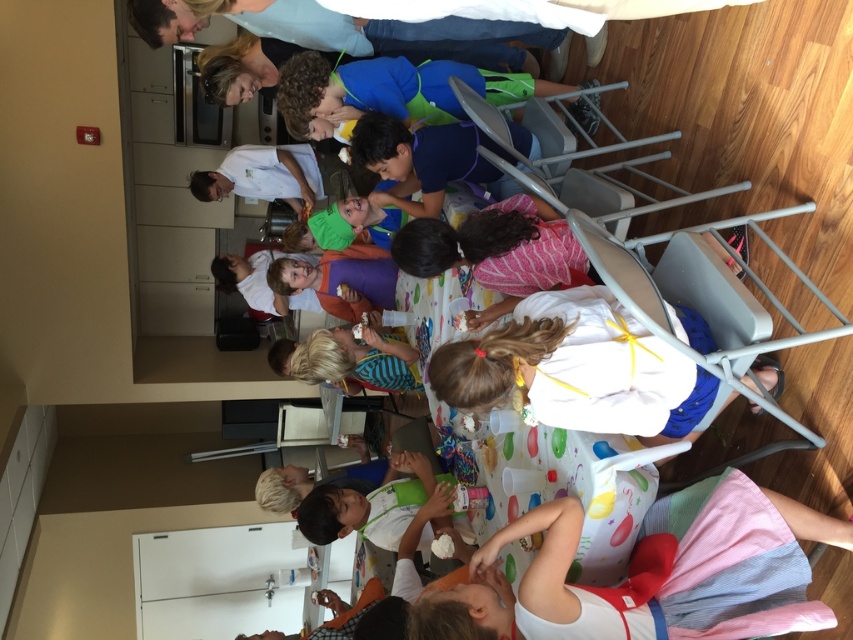
You are a photographer at the event and need to decide which shirt to focus on for a closeup. Since the white fabric shirt at center is wider than the striped fabric shirt at center, which shirt should you choose to capture more details without zooming in?

The white fabric shirt at center has a larger width, so choosing it would allow capturing more details without needing to zoom in compared to the striped fabric shirt at center.

You are a photographer standing at the back of the room. You want to take a photo that includes both the white cotton dress at lower right and the white fabric shirt at center. Can you position yourself so that both are in the frame without moving either object? Explain your reasoning.

The white cotton dress at lower right is 14.58 inches away from the white fabric shirt at center. Since the distance between them is relatively small, positioning yourself at an angle that captures both within the camera frame should be possible without moving either object.